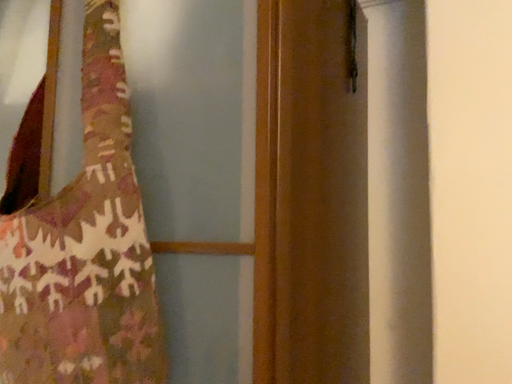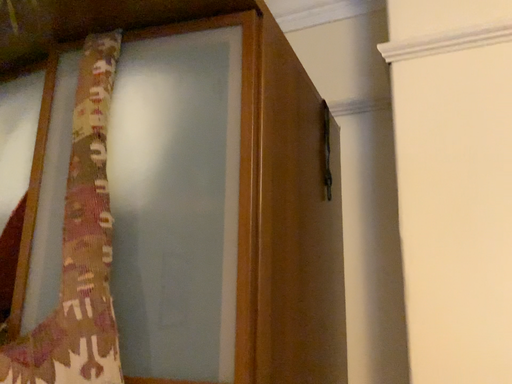
Question: How did the camera likely rotate when shooting the video?

Choices:
 (A) rotated upward
 (B) rotated downward

Answer: (A)